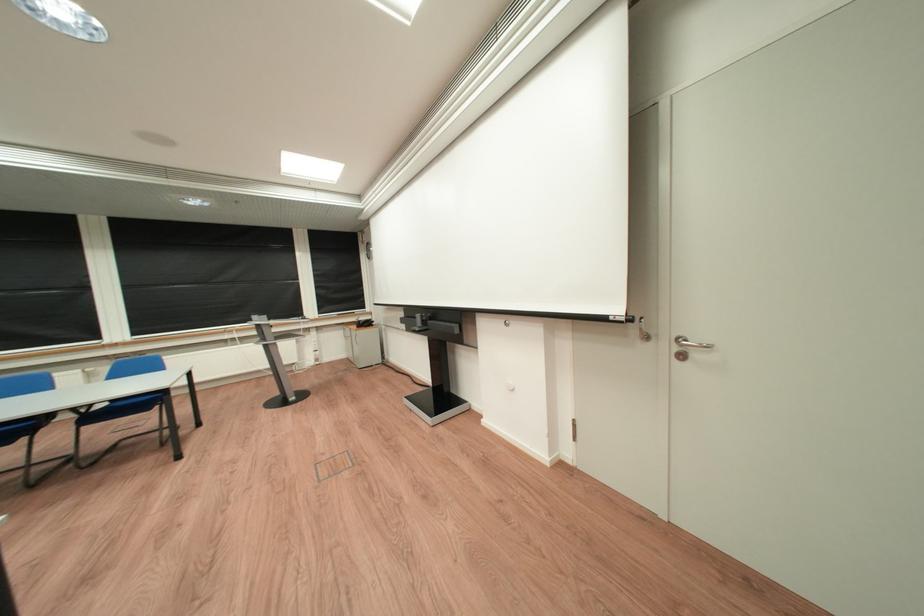
This screenshot has height=616, width=924. Identify the location of silver door handle. (689, 342).